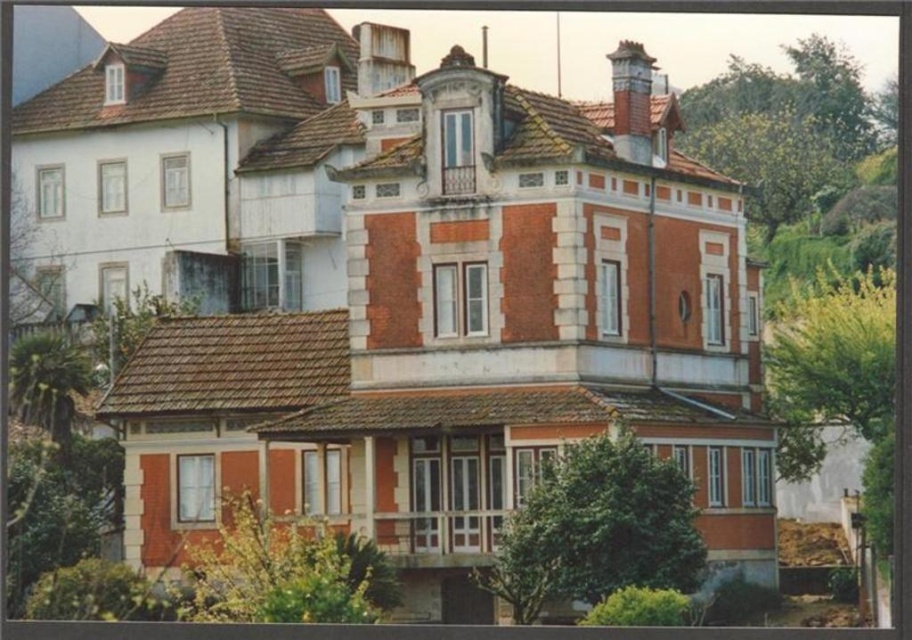
You are standing in front of the residential building and notice two points marked on the facade. The first point is at coordinates point (x=604, y=465) and the second is at point (x=48, y=269). From your perspective, which point appears closer to you?

Point (x=604, y=465) is in front of point (x=48, y=269), so it appears closer to you.

You are standing in front of a residential building and want to know the distance to a specific point marked as point (625, 509). Can you estimate how far it is from your current position?

The point (625, 509) is 68.65 meters away from the viewer, so the distance is approximately 68.65 meters.